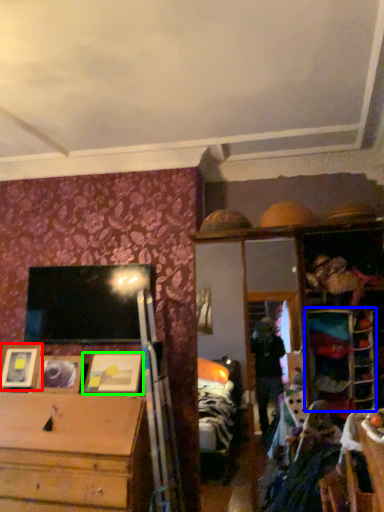
Question: Which object is positioned closest to picture frame (highlighted by a red box)? Select from shelf (highlighted by a blue box) and picture frame (highlighted by a green box).

Choices:
 (A) shelf
 (B) picture frame

Answer: (B)